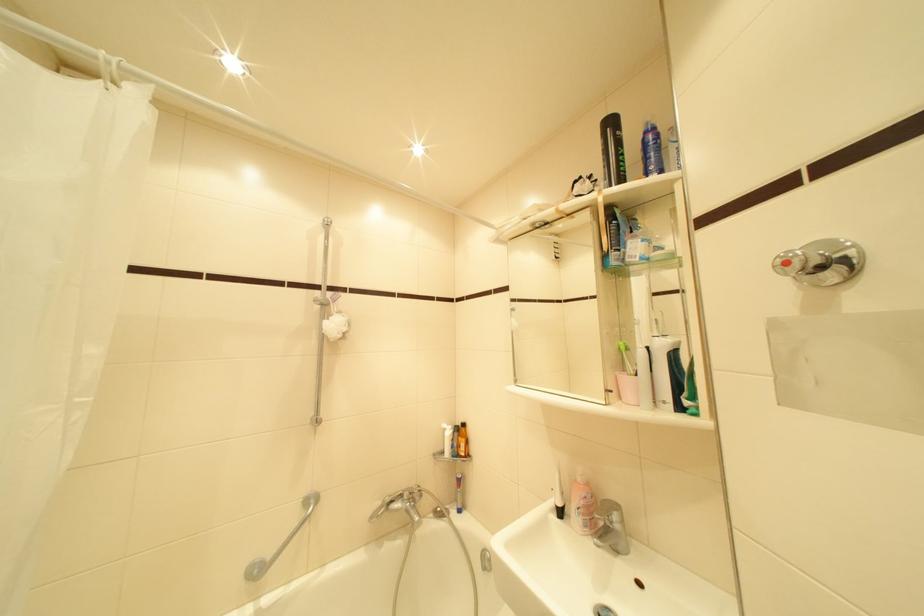
This screenshot has width=924, height=616. What are the coordinates of `mirrored cabinet door` in the screenshot? It's located at (561, 309).